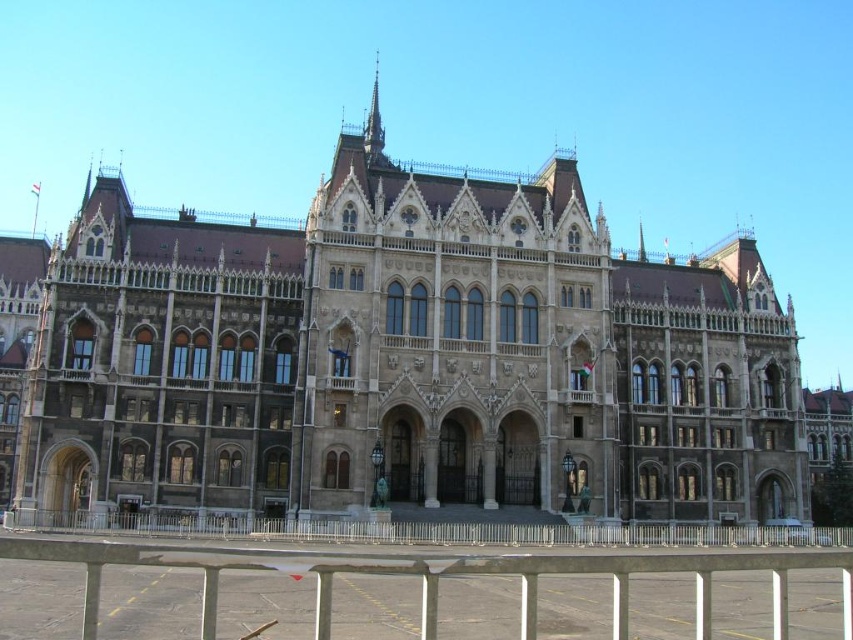
Which is below, metallic silver rail at lower center or metallic silver fence at lower center?

metallic silver fence at lower center

Who is more forward, (215,577) or (311,529)?

Point (215,577)

Where is `metallic silver rail at lower center`? metallic silver rail at lower center is located at coordinates (434, 576).